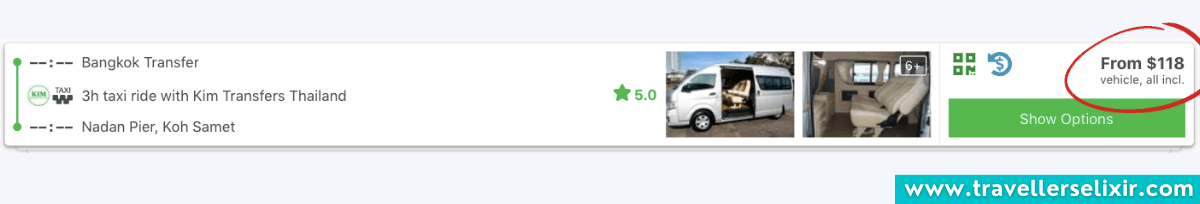
At what (x,y) coordinates should I click in order to perform the action: click on windows. Please return your answer as a coordinate pair (x, y). This screenshot has height=204, width=1200. Looking at the image, I should click on (768, 86), (702, 87).